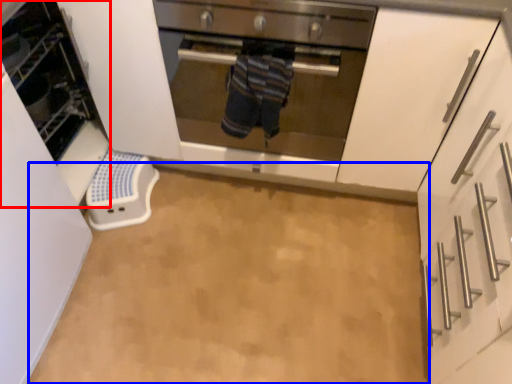
Question: Which point is closer to the camera, appliance (highlighted by a red box) or plain (highlighted by a blue box)?

Choices:
 (A) appliance
 (B) plain

Answer: (A)